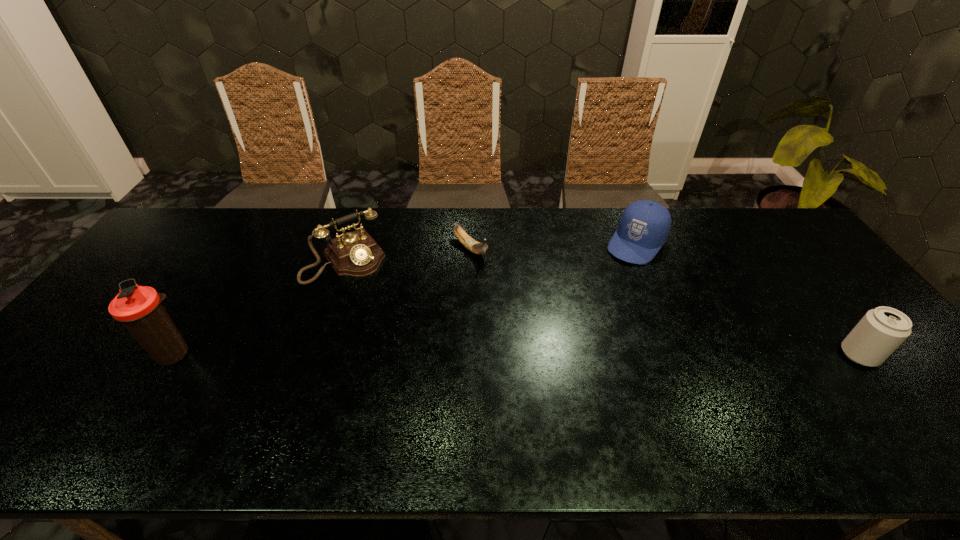
This screenshot has height=540, width=960. I want to click on vacant spot on the desktop that is between the tallest object and the can and is positioned on the dial of the telephone, so click(416, 354).

Image resolution: width=960 pixels, height=540 pixels. Find the location of `free space on the desktop that is between the leftmost object and the can and is positioned at the stem of the shortest object`. free space on the desktop that is between the leftmost object and the can and is positioned at the stem of the shortest object is located at coordinates (592, 355).

Locate an element on the screen. vacant space on the desktop that is between the thermos bottle and the can and is positioned on the front-facing side of the fourth object from left to right is located at coordinates (548, 355).